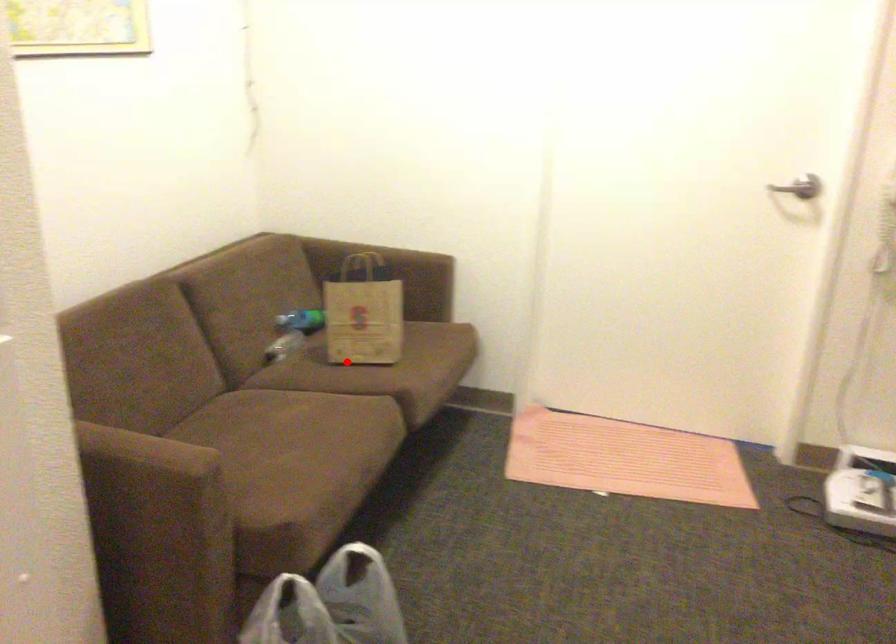
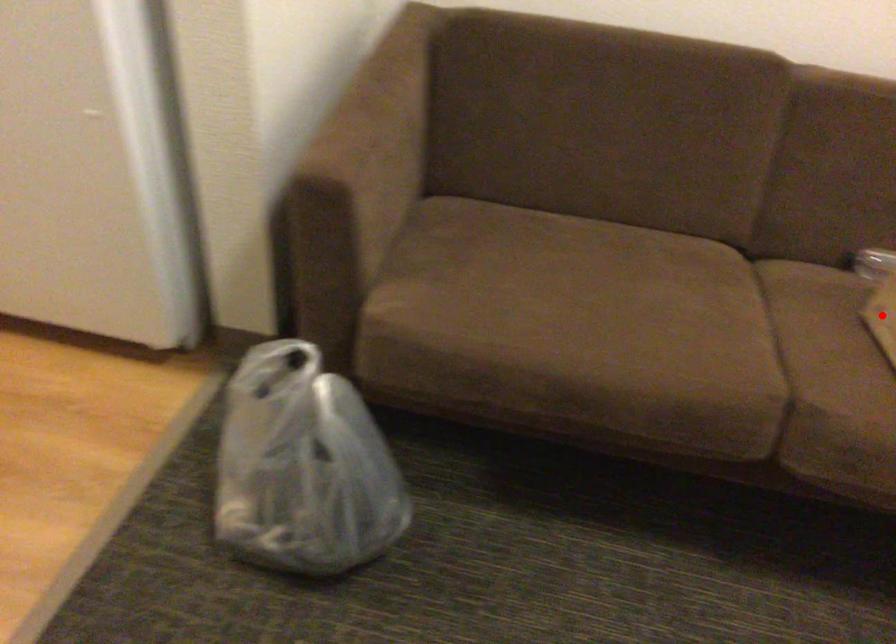
I am providing you with two images of the same scene from different viewpoints. A red point is marked on the first image and another point is marked on the second image. Do the highlighted points in image1 and image2 indicate the same real-world spot?

Yes